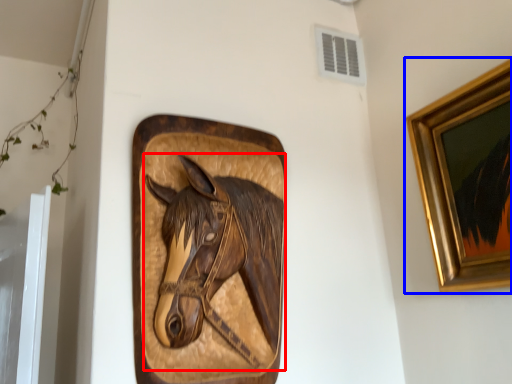
Question: Which object appears farthest to the camera in this image, horse (highlighted by a red box) or picture frame (highlighted by a blue box)?

Choices:
 (A) horse
 (B) picture frame

Answer: (A)